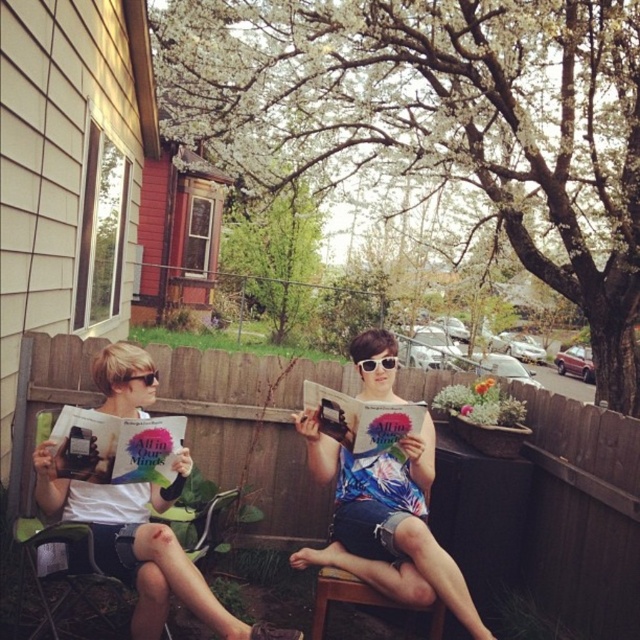
Is green fabric chair at left bigger than green leafy tree at center?

Actually, green fabric chair at left might be smaller than green leafy tree at center.

Can you confirm if green fabric chair at left is wider than green leafy tree at center?

No.

Who is more distant from viewer, [44,499] or [300,218]?

The point [300,218] is more distant.

Identify the location of green fabric chair at left. (134, 545).

Between floral fabric shirt at center and black plastic sunglasses at left, which one is positioned higher?

black plastic sunglasses at left is above.

Where is `floral fabric shirt at center`? Image resolution: width=640 pixels, height=640 pixels. floral fabric shirt at center is located at coordinates (387, 522).

Is white blossoming tree at upper center in front of matte white book at left?

No.

Does white blossoming tree at upper center have a larger size compared to matte white book at left?

Correct, white blossoming tree at upper center is larger in size than matte white book at left.

What do you see at coordinates (440, 122) in the screenshot? This screenshot has width=640, height=640. I see `white blossoming tree at upper center` at bounding box center [440, 122].

At what (x,y) coordinates should I click in order to perform the action: click on white blossoming tree at upper center. Please return your answer as a coordinate pair (x, y). Looking at the image, I should click on (440, 122).